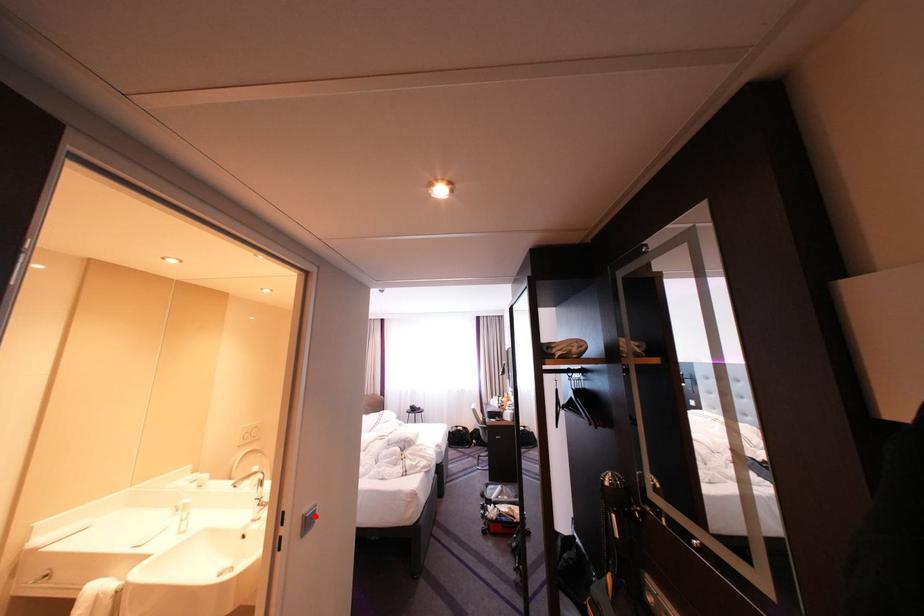
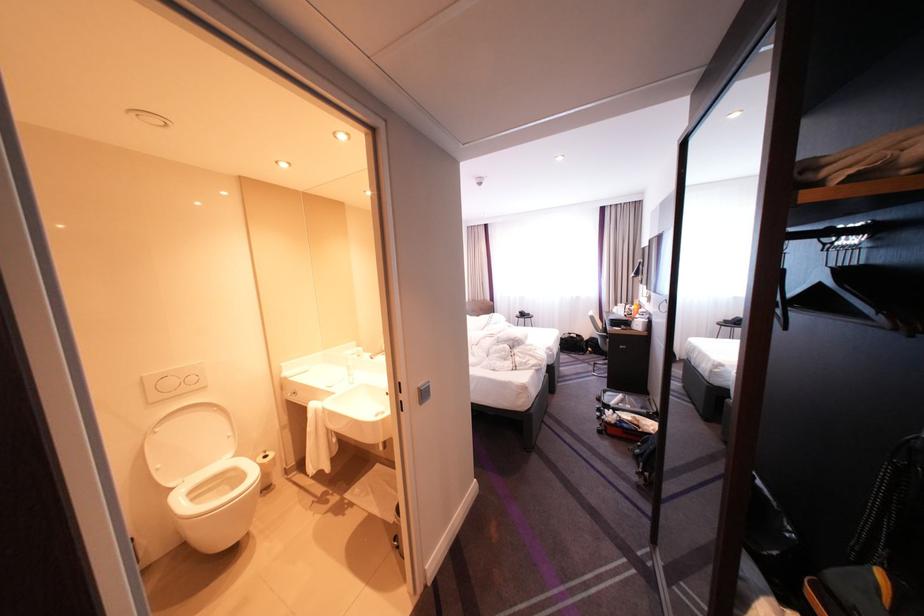
The point at the highlighted location is marked in the first image. Where is the corresponding point in the second image?

(430, 389)